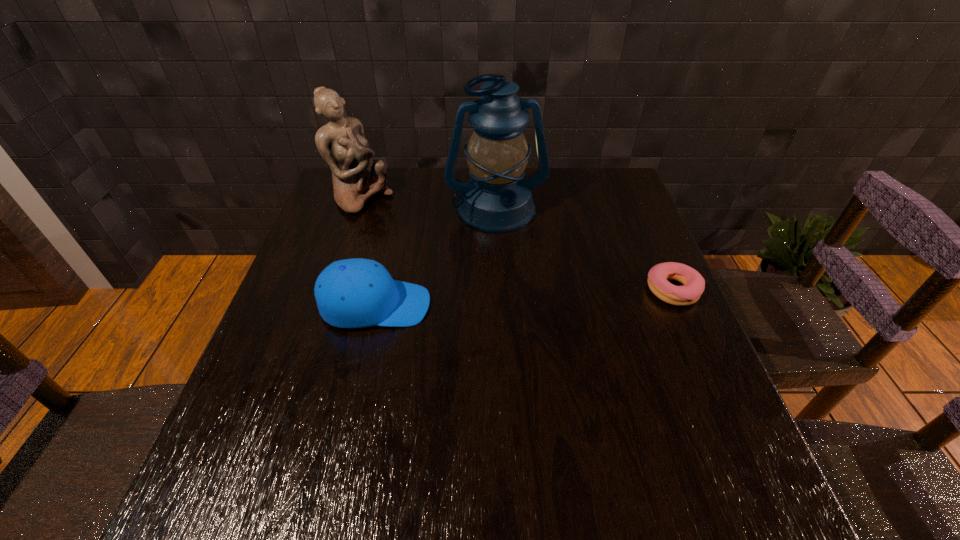
Where is `free space on the desktop that is between the cap and the shortest object and is positioned on the face of the second object from right to left`? free space on the desktop that is between the cap and the shortest object and is positioned on the face of the second object from right to left is located at coordinates (518, 298).

Where is `free space on the desktop that is between the cap and the doughnut and is positioned on the front-facing side of the second tallest object`? Image resolution: width=960 pixels, height=540 pixels. free space on the desktop that is between the cap and the doughnut and is positioned on the front-facing side of the second tallest object is located at coordinates (518, 298).